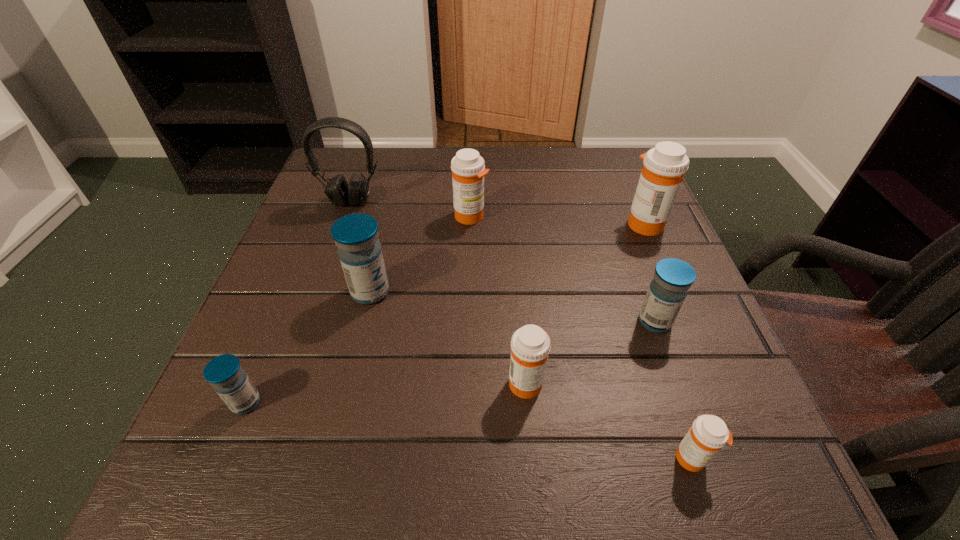
Find the location of a particular element. Image resolution: width=960 pixels, height=540 pixels. the fourth farthest medicine is located at coordinates (667, 291).

Find the location of a particular element. The image size is (960, 540). the leftmost medicine is located at coordinates (225, 373).

Identify the location of the leftmost blue medicine. This screenshot has height=540, width=960. (225, 373).

Identify the location of the second orange medicine from right to left. (708, 434).

Identify the location of the smallest orange medicine. (708, 434).

At what (x,y) coordinates should I click in order to perform the action: click on vacant space situated 0.200m on the front-facing side of the headset. Please return your answer as a coordinate pair (x, y). The image size is (960, 540). Looking at the image, I should click on (326, 272).

Locate an element on the screen. The width and height of the screenshot is (960, 540). free region located on the front of the rightmost orange medicine is located at coordinates (686, 319).

The height and width of the screenshot is (540, 960). I want to click on free space located on the right of the leftmost orange medicine, so click(x=520, y=216).

I want to click on vacant region located on the right of the third farthest medicine, so click(x=522, y=292).

The image size is (960, 540). What are the coordinates of `vacant area situated 0.100m on the right of the second smallest orange medicine` in the screenshot? It's located at click(x=609, y=382).